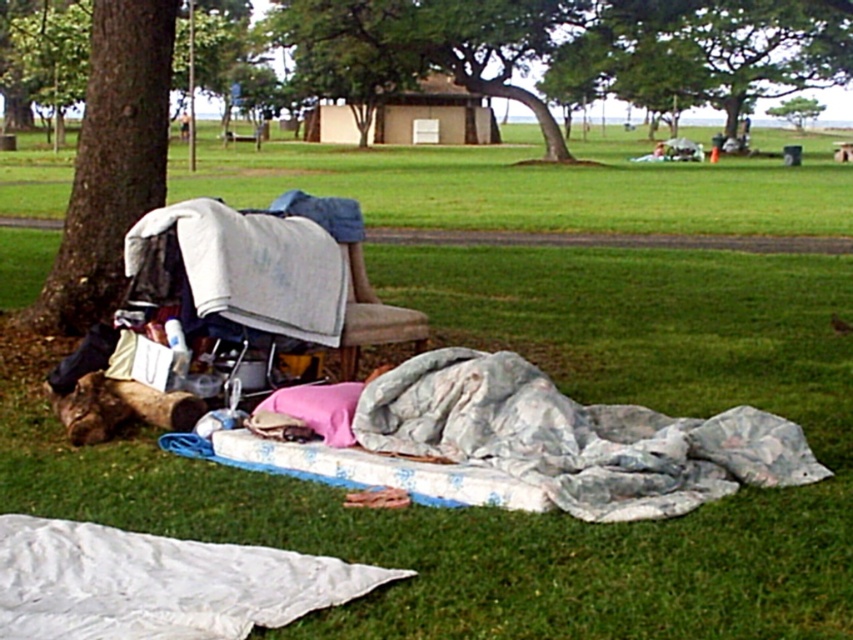
Can you confirm if fluffy white blanket at lower right is taller than green leafy tree at center?

No, fluffy white blanket at lower right is not taller than green leafy tree at center.

Is fluffy white blanket at lower right closer to camera compared to green leafy tree at center?

Yes.

Who is more forward, (660, 484) or (399, 12)?

Positioned in front is point (660, 484).

At what (x,y) coordinates should I click in order to perform the action: click on fluffy white blanket at lower right. Please return your answer as a coordinate pair (x, y). Image resolution: width=853 pixels, height=640 pixels. Looking at the image, I should click on (575, 436).

Does brown rough bark tree at left have a smaller size compared to green leafy tree at upper center?

Indeed, brown rough bark tree at left has a smaller size compared to green leafy tree at upper center.

Which is more to the left, brown rough bark tree at left or green leafy tree at upper center?

Positioned to the left is brown rough bark tree at left.

From the picture: Who is more forward, (108, 164) or (798, 131)?

Point (108, 164) is in front.

Image resolution: width=853 pixels, height=640 pixels. Identify the location of brown rough bark tree at left. click(x=111, y=163).

From the picture: Does fluffy white blanket at lower right have a lesser width compared to brown rough bark tree at left?

No.

Which of these two, fluffy white blanket at lower right or brown rough bark tree at left, stands taller?

Standing taller between the two is brown rough bark tree at left.

Locate an element on the screen. Image resolution: width=853 pixels, height=640 pixels. fluffy white blanket at lower right is located at coordinates (575, 436).